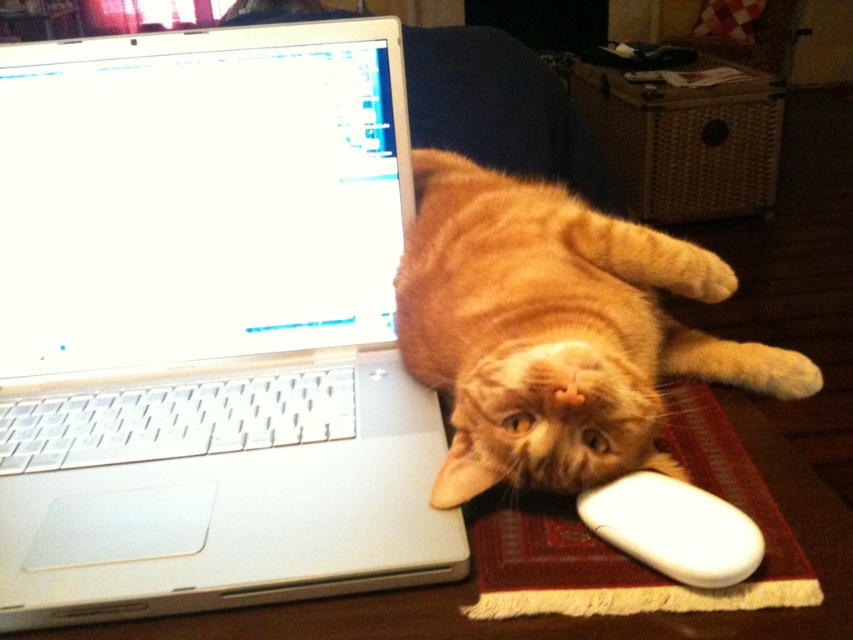
Which of these two, orange fur cat at center or white matte mouse at lower right, stands shorter?

white matte mouse at lower right

Does point (566, 292) lie behind point (734, 515)?

Yes, point (566, 292) is farther from viewer.

Between point (488, 177) and point (697, 516), which one is positioned in front?

Point (697, 516)

Find the location of a particular element. orange fur cat at center is located at coordinates (555, 330).

Is point (200, 588) behind point (733, 528)?

No, it is in front of (733, 528).

Image resolution: width=853 pixels, height=640 pixels. I want to click on silver metallic laptop at upper left, so (207, 326).

Is red woven mat at lower right smaller than white matte mouse at lower right?

No, red woven mat at lower right is not smaller than white matte mouse at lower right.

What are the coordinates of `red woven mat at lower right` in the screenshot? It's located at (624, 554).

Which is behind, point (619, 588) or point (624, 476)?

Positioned behind is point (624, 476).

This screenshot has height=640, width=853. What are the coordinates of `red woven mat at lower right` in the screenshot? It's located at (624, 554).